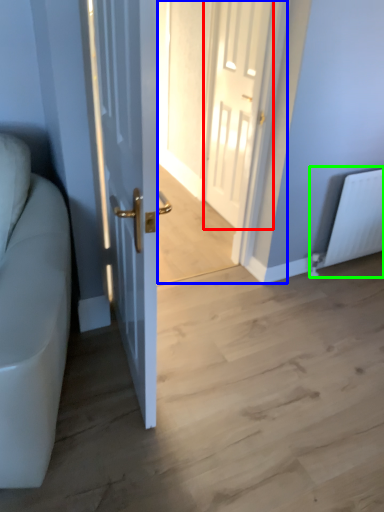
Question: Which object is positioned farthest from door (highlighted by a red box)? Select from glass door (highlighted by a blue box) and radiator (highlighted by a green box).

Choices:
 (A) glass door
 (B) radiator

Answer: (B)